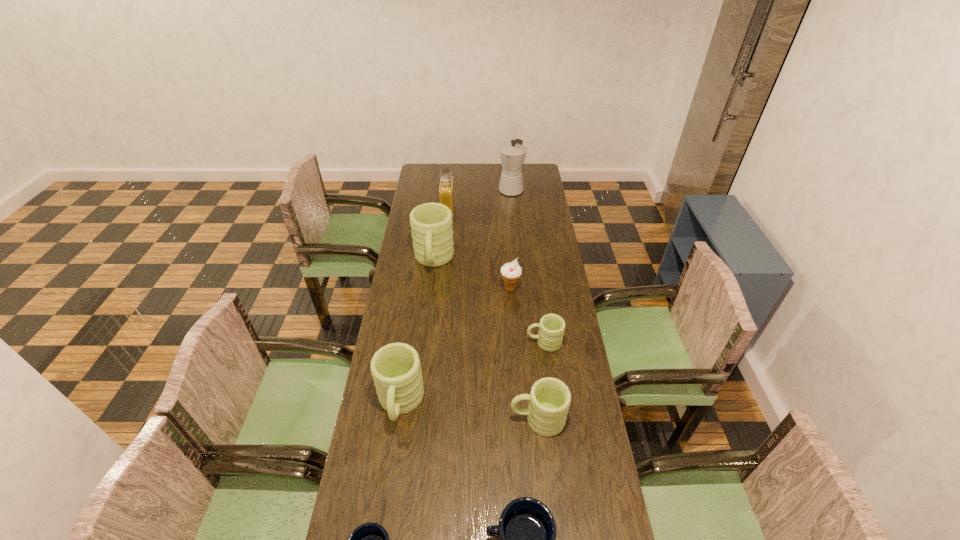
I want to click on vacant region located on the side of the second farthest mug with the handle, so click(x=430, y=343).

Locate an element on the screen. The width and height of the screenshot is (960, 540). free point located 0.320m on the side of the second farthest mug with the handle is located at coordinates (441, 343).

You are a GUI agent. You are given a task and a screenshot of the screen. Output one action in this format:
    pyautogui.click(x=<x>, y=<y>)
    Task: Click on the object that is at the far edge
    The width and height of the screenshot is (960, 540).
    Given the screenshot: What is the action you would take?
    pyautogui.click(x=513, y=154)

Where is `coffeepot present at the right edge`? coffeepot present at the right edge is located at coordinates (513, 154).

The image size is (960, 540). I want to click on object that is positioned at the far right corner, so click(513, 154).

Where is `vacant space at the far edge`? The height and width of the screenshot is (540, 960). vacant space at the far edge is located at coordinates (457, 172).

The height and width of the screenshot is (540, 960). Identify the location of vacant space at the left edge of the desktop. (417, 327).

Where is `vacant space at the right edge of the desktop`? vacant space at the right edge of the desktop is located at coordinates (572, 477).

Locate an element on the screen. This screenshot has width=960, height=540. free area in between the fifth shortest mug and the seventh tallest object is located at coordinates 472,373.

The width and height of the screenshot is (960, 540). In order to click on empty space that is in between the fifth shortest mug and the farthest green mug in this screenshot , I will do `click(417, 332)`.